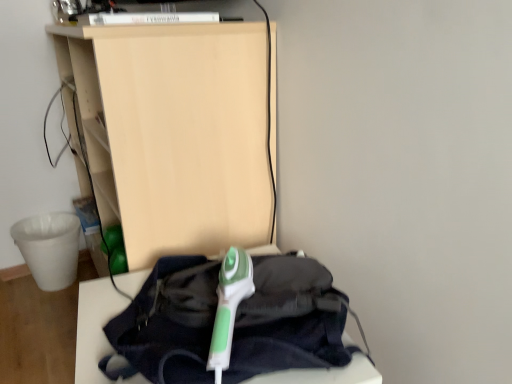
What is the approximate height of green plastic iron at center, which is the 2th furniture from top to bottom?

The height of green plastic iron at center, which is the 2th furniture from top to bottom, is 17.88 inches.

Measure the distance between point (88, 298) and camera.

A distance of 1.07 meters exists between point (88, 298) and camera.

Locate an element on the screen. The image size is (512, 384). green plastic iron at center is located at coordinates (229, 306).

How much distance is there between matte wood shelf at upper center, which is counted as the first furniture, starting from the top, and green plastic iron at center, which is the 2th furniture from top to bottom?

matte wood shelf at upper center, which is counted as the first furniture, starting from the top, and green plastic iron at center, which is the 2th furniture from top to bottom, are 15.29 inches apart.

Is point (105, 87) closer or farther from the camera than point (321, 383)?

Point (105, 87) is positioned farther from the camera compared to point (321, 383).

Which of these two, matte wood shelf at upper center, which is counted as the first furniture, starting from the top, or green plastic iron at center, positioned as the 1th furniture in bottom-to-top order, is wider?

Wider between the two is green plastic iron at center, positioned as the 1th furniture in bottom-to-top order.

Are green plastic iron at center and matte wood shelf at upper center, which is counted as the first furniture, starting from the top, located far from each other?

No.

Is green plastic iron at center positioned before matte wood shelf at upper center, the 2th furniture in the bottom-to-top sequence?

Yes, green plastic iron at center is closer to the camera.

Does green plastic iron at center contain matte wood shelf at upper center, the 2th furniture in the bottom-to-top sequence?

Definitely not — matte wood shelf at upper center, the 2th furniture in the bottom-to-top sequence, is not inside green plastic iron at center.

From a real-world perspective, is green plastic iron at center positioned over matte wood shelf at upper center, the 2th furniture in the bottom-to-top sequence, based on gravity?

Correct, in the physical world, green plastic iron at center is higher than matte wood shelf at upper center, the 2th furniture in the bottom-to-top sequence.

In the image, there is a green plastic iron at center, which is the 2th furniture from top to bottom. Identify the location of equipment above it (from the image's perspective). (229, 306).

Between green plastic iron at center and green plastic iron at center, which is the 2th furniture from top to bottom, which one appears on the left side from the viewer's perspective?

green plastic iron at center, which is the 2th furniture from top to bottom, is more to the left.

Is green plastic iron at center directly adjacent to green plastic iron at center, positioned as the 1th furniture in bottom-to-top order?

green plastic iron at center and green plastic iron at center, positioned as the 1th furniture in bottom-to-top order, are not in contact.

From a real-world perspective, who is located higher, green plastic iron at center or green plastic iron at center, which is the 2th furniture from top to bottom?

From a 3D spatial view, green plastic iron at center is above.

Is green plastic iron at center, which is the 2th furniture from top to bottom, completely or partially outside of green plastic iron at center?

Yes.

Looking at their sizes, would you say green plastic iron at center, which is the 2th furniture from top to bottom, is wider or thinner than green plastic iron at center?

In the image, green plastic iron at center, which is the 2th furniture from top to bottom, appears to be wider than green plastic iron at center.

Is point (282, 372) closer or farther from the camera than point (238, 289)?

Point (282, 372) appears to be closer to the viewer than point (238, 289).

Between green plastic iron at center, which is the 2th furniture from top to bottom, and green plastic iron at center, which one appears on the right side from the viewer's perspective?

green plastic iron at center.

In terms of width, does matte wood shelf at upper center, the 2th furniture in the bottom-to-top sequence, look wider or thinner when compared to green plastic iron at center?

Considering their sizes, matte wood shelf at upper center, the 2th furniture in the bottom-to-top sequence, looks broader than green plastic iron at center.

Which object is closer to the camera, matte wood shelf at upper center, which is counted as the first furniture, starting from the top, or green plastic iron at center?

Positioned in front is green plastic iron at center.

Is point (302, 382) closer to camera compared to point (109, 175)?

That is True.

Is green plastic iron at center, positioned as the 1th furniture in bottom-to-top order, wider or thinner than matte wood shelf at upper center, the 2th furniture in the bottom-to-top sequence?

Clearly, green plastic iron at center, positioned as the 1th furniture in bottom-to-top order, has more width compared to matte wood shelf at upper center, the 2th furniture in the bottom-to-top sequence.

From the image's perspective, is green plastic iron at center, positioned as the 1th furniture in bottom-to-top order, located above or below matte wood shelf at upper center, which is counted as the first furniture, starting from the top?

Clearly, from the image's perspective, green plastic iron at center, positioned as the 1th furniture in bottom-to-top order, is below matte wood shelf at upper center, which is counted as the first furniture, starting from the top.

Where is `furniture above the green plastic iron at center, positioned as the 1th furniture in bottom-to-top order (from a real-world perspective)`? The image size is (512, 384). furniture above the green plastic iron at center, positioned as the 1th furniture in bottom-to-top order (from a real-world perspective) is located at coordinates (174, 132).

Locate an element on the screen. Image resolution: width=512 pixels, height=384 pixels. furniture that is behind the green plastic iron at center, positioned as the 1th furniture in bottom-to-top order is located at coordinates (174, 132).

Locate an element on the screen. equipment below the matte wood shelf at upper center, which is counted as the first furniture, starting from the top (from the image's perspective) is located at coordinates (229, 306).

Considering their positions, is matte wood shelf at upper center, which is counted as the first furniture, starting from the top, positioned closer to green plastic iron at center, positioned as the 1th furniture in bottom-to-top order, than green plastic iron at center?

Based on the image, green plastic iron at center appears to be nearer to green plastic iron at center, positioned as the 1th furniture in bottom-to-top order.

Considering their positions, is green plastic iron at center positioned further to green plastic iron at center, which is the 2th furniture from top to bottom, than matte wood shelf at upper center, which is counted as the first furniture, starting from the top?

matte wood shelf at upper center, which is counted as the first furniture, starting from the top, lies further to green plastic iron at center, which is the 2th furniture from top to bottom, than the other object.

From the image, which object appears to be farther from green plastic iron at center, matte wood shelf at upper center, which is counted as the first furniture, starting from the top, or green plastic iron at center, positioned as the 1th furniture in bottom-to-top order?

Among the two, matte wood shelf at upper center, which is counted as the first furniture, starting from the top, is located further to green plastic iron at center.

Looking at the image, which one is located further to matte wood shelf at upper center, which is counted as the first furniture, starting from the top, green plastic iron at center or green plastic iron at center, positioned as the 1th furniture in bottom-to-top order?

green plastic iron at center, positioned as the 1th furniture in bottom-to-top order.

From the image, which object appears to be farther from green plastic iron at center, green plastic iron at center, positioned as the 1th furniture in bottom-to-top order, or matte wood shelf at upper center, which is counted as the first furniture, starting from the top?

Based on the image, matte wood shelf at upper center, which is counted as the first furniture, starting from the top, appears to be further to green plastic iron at center.

Based on their spatial positions, is green plastic iron at center, positioned as the 1th furniture in bottom-to-top order, or green plastic iron at center closer to matte wood shelf at upper center, which is counted as the first furniture, starting from the top?

green plastic iron at center is positioned closer to the anchor matte wood shelf at upper center, which is counted as the first furniture, starting from the top.

Locate an element on the screen. The height and width of the screenshot is (384, 512). equipment between matte wood shelf at upper center, which is counted as the first furniture, starting from the top, and green plastic iron at center, positioned as the 1th furniture in bottom-to-top order, in the vertical direction is located at coordinates 229,306.